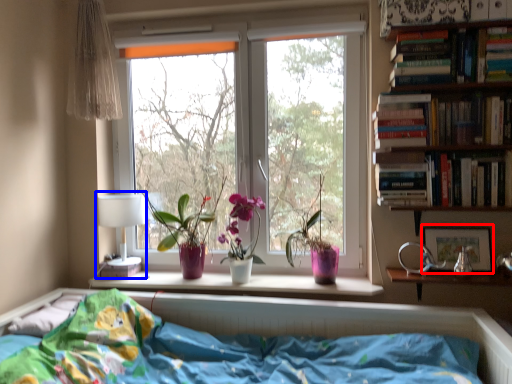
Question: Which object is closer to the camera taking this photo, picture frame (highlighted by a red box) or table lamp (highlighted by a blue box)?

Choices:
 (A) picture frame
 (B) table lamp

Answer: (A)